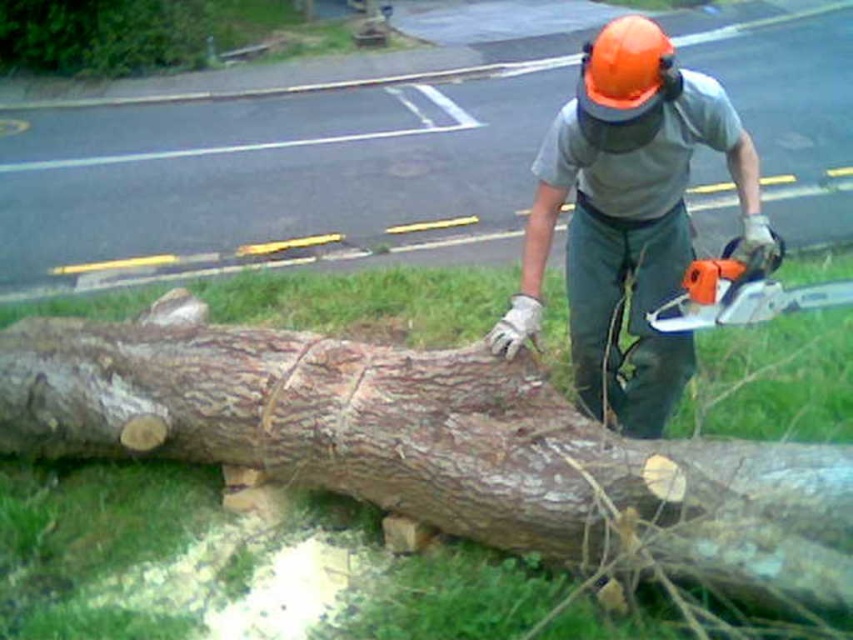
Who is shorter, brown rough wood at center or orange hard hat at upper center?

With less height is brown rough wood at center.

Is point (520, 509) positioned before point (691, 132)?

Yes, it is in front of point (691, 132).

The image size is (853, 640). In order to click on brown rough wood at center in this screenshot , I will do `click(436, 448)`.

Is orange hard hat at upper center to the left of orange plastic chainsaw at center from the viewer's perspective?

Yes, orange hard hat at upper center is to the left of orange plastic chainsaw at center.

Can you confirm if orange hard hat at upper center is thinner than orange plastic chainsaw at center?

No, orange hard hat at upper center is not thinner than orange plastic chainsaw at center.

Where is `orange hard hat at upper center`? This screenshot has width=853, height=640. orange hard hat at upper center is located at coordinates [628, 218].

At what (x,y) coordinates should I click in order to perform the action: click on orange hard hat at upper center. Please return your answer as a coordinate pair (x, y). Looking at the image, I should click on (628, 218).

Is brown rough wood at center positioned at the back of orange plastic chainsaw at center?

No, brown rough wood at center is closer to the viewer.

Who is taller, brown rough wood at center or orange plastic chainsaw at center?

Standing taller between the two is brown rough wood at center.

Image resolution: width=853 pixels, height=640 pixels. What do you see at coordinates (436, 448) in the screenshot? I see `brown rough wood at center` at bounding box center [436, 448].

Locate an element on the screen. The height and width of the screenshot is (640, 853). brown rough wood at center is located at coordinates (436, 448).